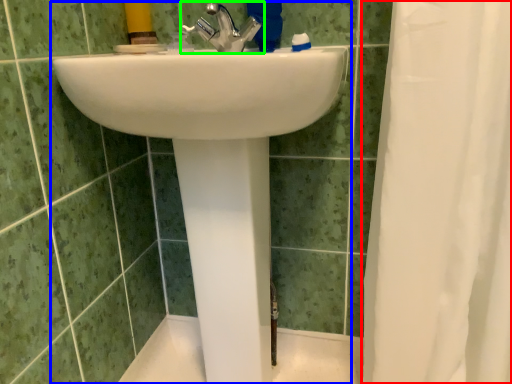
Question: Based on their relative distances, which object is nearer to shower curtain (highlighted by a red box)? Choose from sink (highlighted by a blue box) and tap (highlighted by a green box).

Choices:
 (A) sink
 (B) tap

Answer: (A)